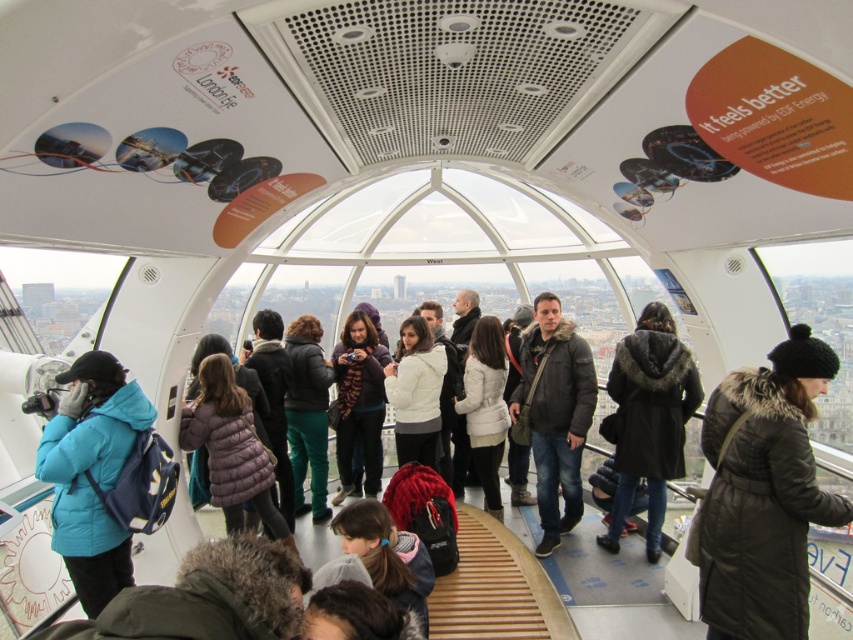
Question: Among these points, which one is nearest to the camera?

Choices:
 (A) (434, 360)
 (B) (721, 401)
 (C) (283, 493)
 (D) (213, 381)

Answer: (B)

Question: Estimate the real-world distances between objects in this image. Which object is closer to the teal fabric jacket at center?

Choices:
 (A) dark gray jacket at center
 (B) purple puffer jacket at center
 (C) white fuzzy coat at center
 (D) dark brown fur-lined coat at center

Answer: (B)

Question: From the image, what is the correct spatial relationship of matte blue jacket at left in relation to dark brown hair at center?

Choices:
 (A) above
 (B) below

Answer: (A)

Question: Does black fur-trimmed coat at center have a greater width compared to dark brown hair at center?

Choices:
 (A) no
 (B) yes

Answer: (B)

Question: Which object is the farthest from the dark brown hair at center?

Choices:
 (A) dark purple puffer jacket at center
 (B) knitted scarf at center
 (C) matte blue jacket at left
 (D) teal fabric jacket at center

Answer: (C)

Question: Is matte blue jacket at left below teal fabric jacket at center?

Choices:
 (A) yes
 (B) no

Answer: (A)